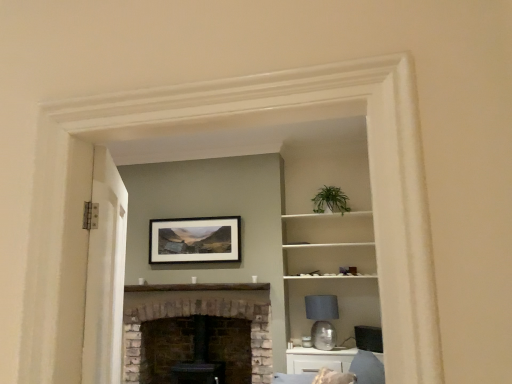
Question: From a real-world perspective, is white painted wood door at left positioned above or below matte gray glass lampshade at center-right?

Choices:
 (A) below
 (B) above

Answer: (B)

Question: Is point click(x=106, y=233) positioned closer to the camera than point click(x=329, y=344)?

Choices:
 (A) closer
 (B) farther

Answer: (A)

Question: Which of these objects is positioned farthest from the matte gray glass lampshade at center-right?

Choices:
 (A) white stone fireplace at center
 (B) white glossy cabinet at lower right
 (C) white painted wood door at left
 (D) matte black picture frame at center

Answer: (C)

Question: Which of these objects is positioned farthest from the white glossy cabinet at lower right?

Choices:
 (A) matte black picture frame at center
 (B) white painted wood door at left
 (C) matte gray glass lampshade at center-right
 (D) white stone fireplace at center

Answer: (B)